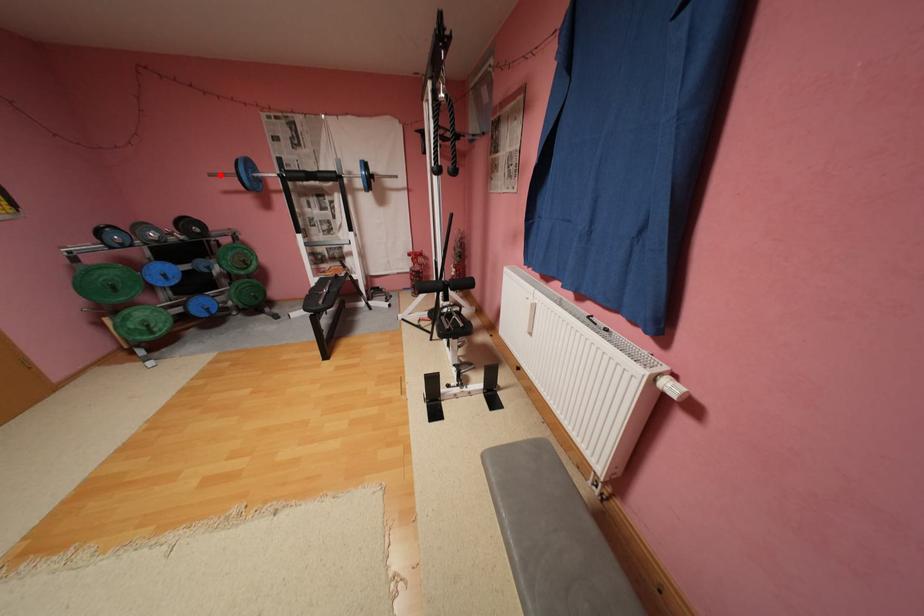
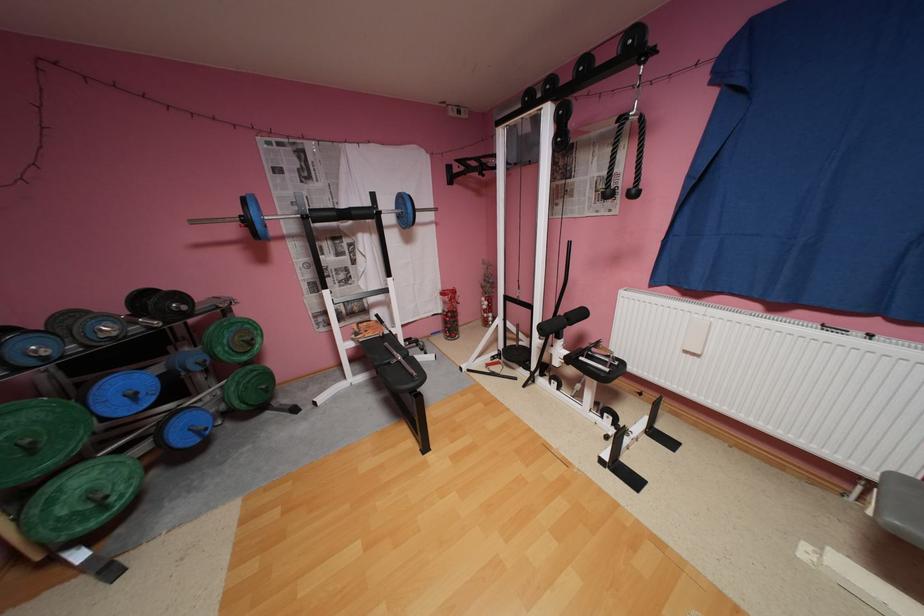
Question: I am providing you with two images of the same scene from different viewpoints. A red point is shown in image1. For the corresponding object point in image2, is it positioned nearer or farther from the camera?

Choices:
 (A) Nearer
 (B) Farther

Answer: (B)